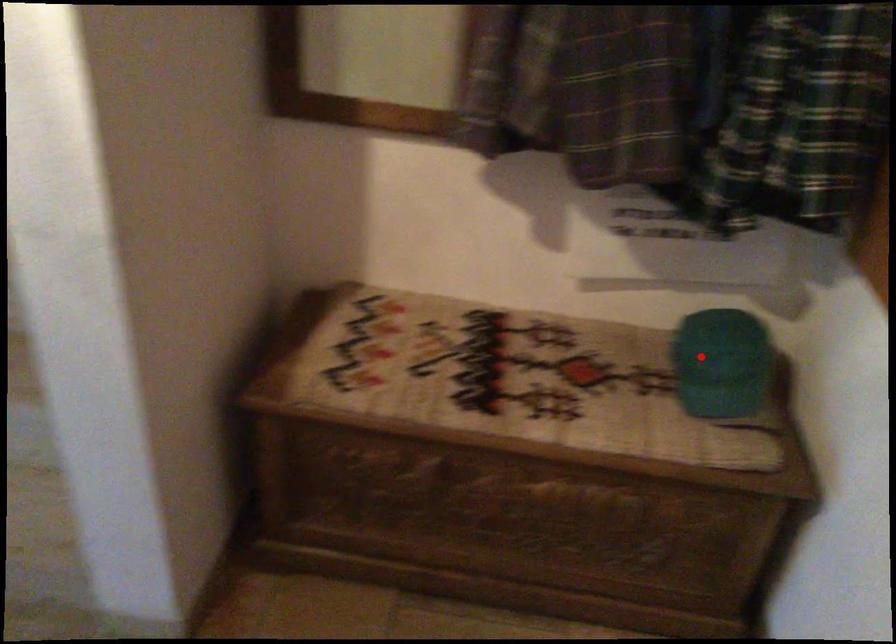
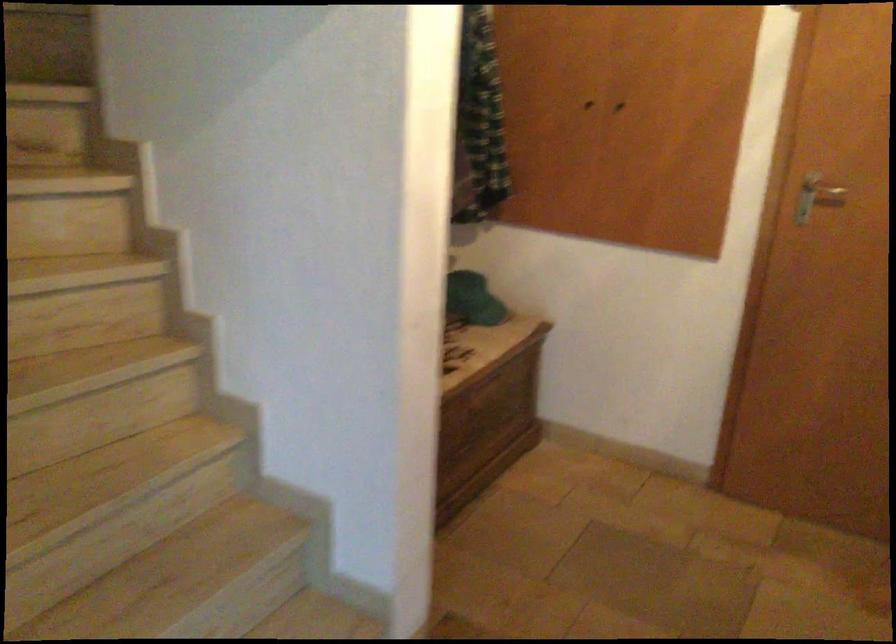
Where in the second image is the point corresponding to the highlighted location from the first image?

(472, 299)